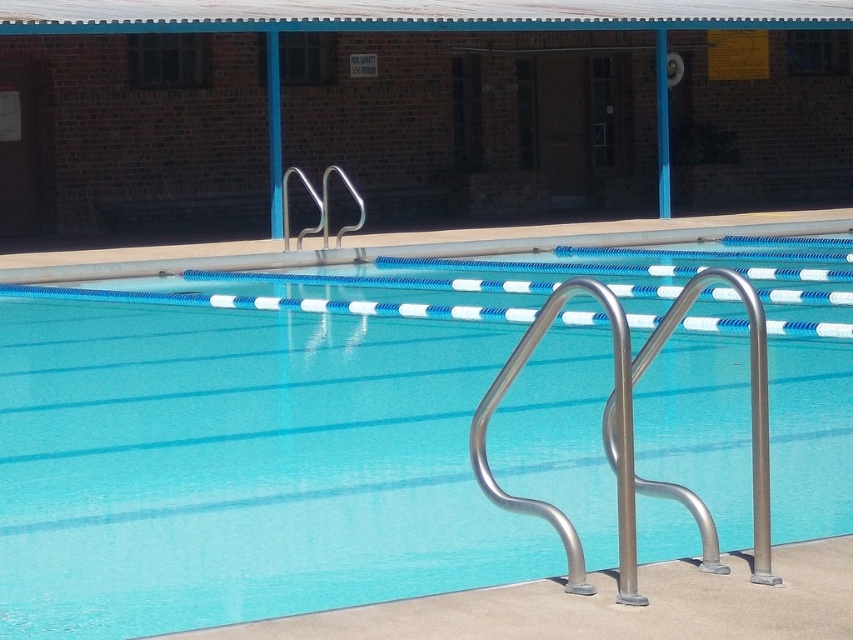
Does clear blue water at center have a smaller size compared to silver metallic handrail at center?

No, clear blue water at center is not smaller than silver metallic handrail at center.

Can you confirm if clear blue water at center is thinner than silver metallic handrail at center?

No, clear blue water at center is not thinner than silver metallic handrail at center.

Is point (686, 547) closer to camera compared to point (642, 600)?

No, it is behind (642, 600).

At what (x,y) coordinates should I click in order to perform the action: click on clear blue water at center. Please return your answer as a coordinate pair (x, y). This screenshot has height=640, width=853. Looking at the image, I should click on (250, 449).

Is clear blue water at center wider than concrete at center?

Yes, clear blue water at center is wider than concrete at center.

Which is more to the left, clear blue water at center or concrete at center?

Positioned to the left is clear blue water at center.

The height and width of the screenshot is (640, 853). I want to click on clear blue water at center, so click(250, 449).

The height and width of the screenshot is (640, 853). In order to click on clear blue water at center in this screenshot , I will do `click(250, 449)`.

Is point (436, 634) behind point (288, 227)?

That is False.

Locate an element on the screen. concrete at center is located at coordinates (605, 605).

The height and width of the screenshot is (640, 853). Find the location of `concrete at center`. concrete at center is located at coordinates (605, 605).